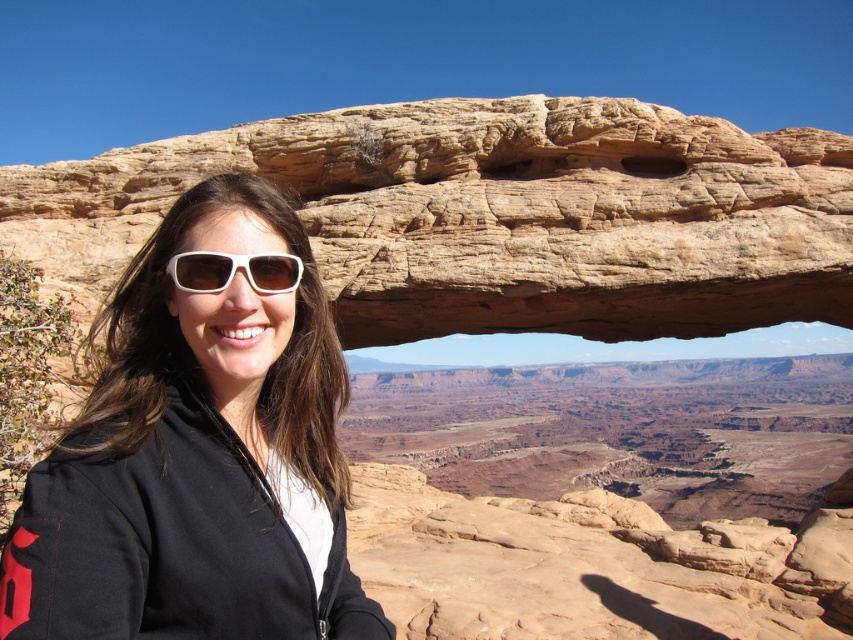
Between rustic sandstone arch at center and white matte sunglasses at center, which one is positioned higher?

rustic sandstone arch at center is higher up.

Between rustic sandstone arch at center and white matte sunglasses at center, which one is positioned lower?

Positioned lower is white matte sunglasses at center.

Identify the location of rustic sandstone arch at center. [496, 216].

At what (x,y) coordinates should I click in order to perform the action: click on rustic sandstone arch at center. Please return your answer as a coordinate pair (x, y). This screenshot has width=853, height=640. Looking at the image, I should click on (496, 216).

Is matte black jacket at left above white matte sunglasses at center?

Actually, matte black jacket at left is below white matte sunglasses at center.

Is matte black jacket at left behind white matte sunglasses at center?

No, it is not.

Measure the distance between point (233, 584) and camera.

Point (233, 584) and camera are 23.01 meters apart from each other.

The image size is (853, 640). Identify the location of matte black jacket at left. (196, 456).

Describe the element at coordinates (496, 216) in the screenshot. I see `rustic sandstone arch at center` at that location.

Is rustic sandstone arch at center above matte black jacket at left?

Yes, rustic sandstone arch at center is above matte black jacket at left.

Is point (674, 296) farther from camera compared to point (181, 532)?

Yes, it is behind point (181, 532).

This screenshot has height=640, width=853. I want to click on rustic sandstone arch at center, so click(x=496, y=216).